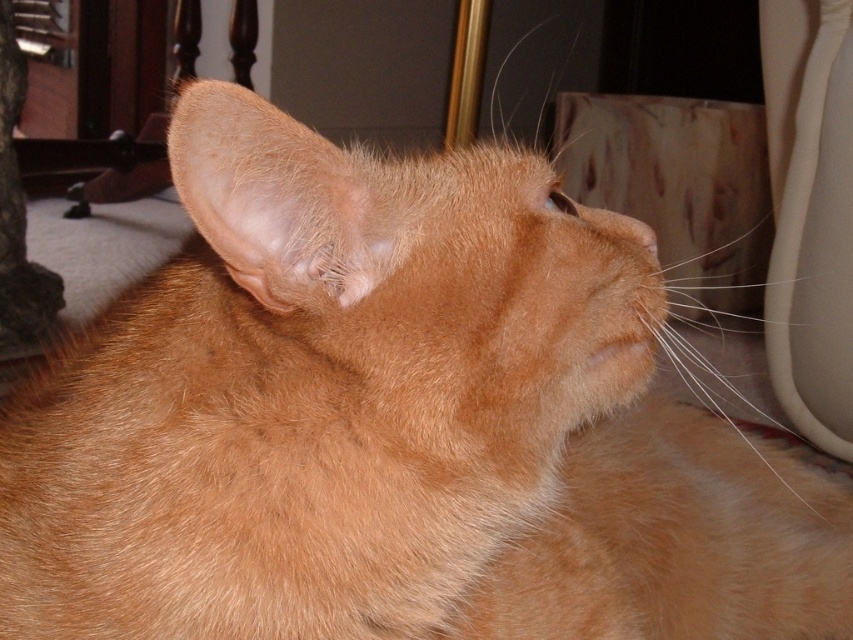
You are a photographer trying to capture the orange tabby cat in the image. You want to ensure the orange fur nose at center is visible above the orange fur at center. Is this possible based on their positions?

The orange fur at center is positioned under the orange fur nose at center, so yes, the nose will naturally appear above the fur in the image.

You are standing in a room and see two points marked on the wall. The first point is at coordinate point(180,188) and the second is at point(608,212). Which point is closer to you?

Point(180,188) is in front of point(608,212), so it is closer to you.